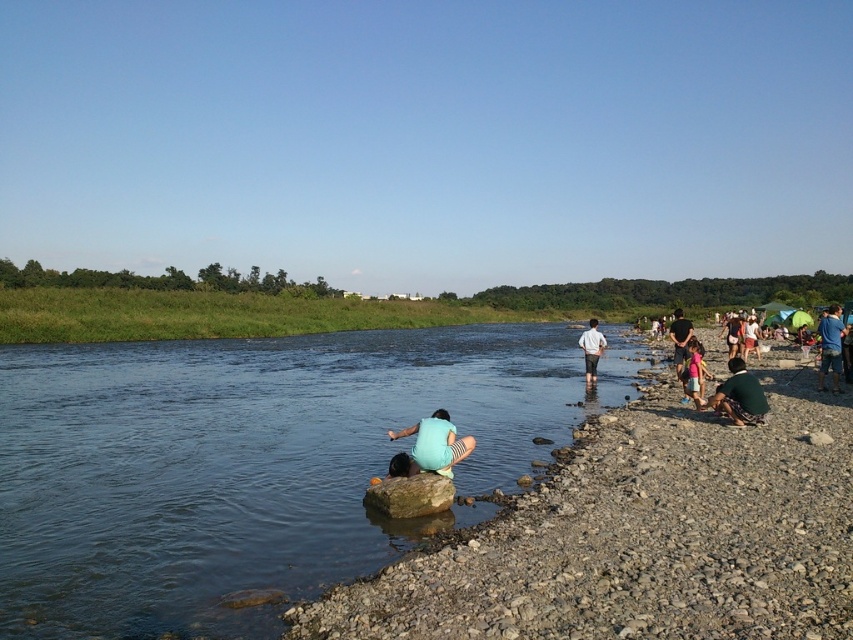
Between clear blue water at center and light blue fabric shirt at right, which one is positioned higher?

light blue fabric shirt at right is higher up.

Is clear blue water at center to the right of light blue fabric shirt at right from the viewer's perspective?

Incorrect, clear blue water at center is not on the right side of light blue fabric shirt at right.

Which is in front, point (56, 461) or point (741, 332)?

Point (56, 461)

Locate an element on the screen. The height and width of the screenshot is (640, 853). clear blue water at center is located at coordinates (248, 464).

Is pink fabric dress at lower right positioned at the back of white cotton shirt at center?

That is False.

Locate an element on the screen. Image resolution: width=853 pixels, height=640 pixels. pink fabric dress at lower right is located at coordinates (695, 372).

Who is positioned more to the left, clear blue water at center or light blue fabric at center?

clear blue water at center

Looking at this image, between clear blue water at center and light blue fabric at center, which one has less height?

light blue fabric at center is shorter.

Is point (86, 442) more distant than point (444, 408)?

That is False.

Identify the location of clear blue water at center. The width and height of the screenshot is (853, 640). (248, 464).